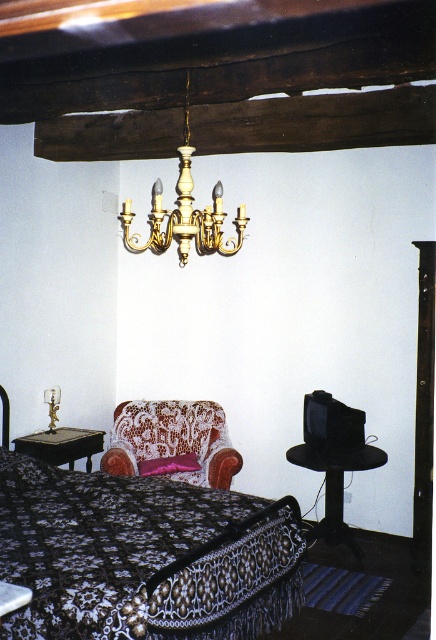
You are standing in the room and want to place a new painting between the black lace bed at center and the gold polished chandelier at upper center. Based on their positions, where should the painting be placed?

The painting should be placed to the right of the black lace bed at center since it is located to the left of the gold polished chandelier at upper center.

You are standing in the room and want to place a new decorative item on the closest object to you between the black lace bed at center and the pink satin pillow at center. Which object should you choose?

The black lace bed at center is closer to the viewer than the pink satin pillow at center, so you should place the decorative item on the black lace bed at center.

You are standing in the room and want to place a new rug exactly at the center of the room. The black lace bed at center is currently located at point 0.870, 0.323. Is the bed positioned exactly at the center of the room?

The black lace bed at center is located at point (140, 556), which does not correspond to the exact center of the room. The exact center would be at point (218, 320). Therefore, the bed is not positioned exactly at the center of the room.